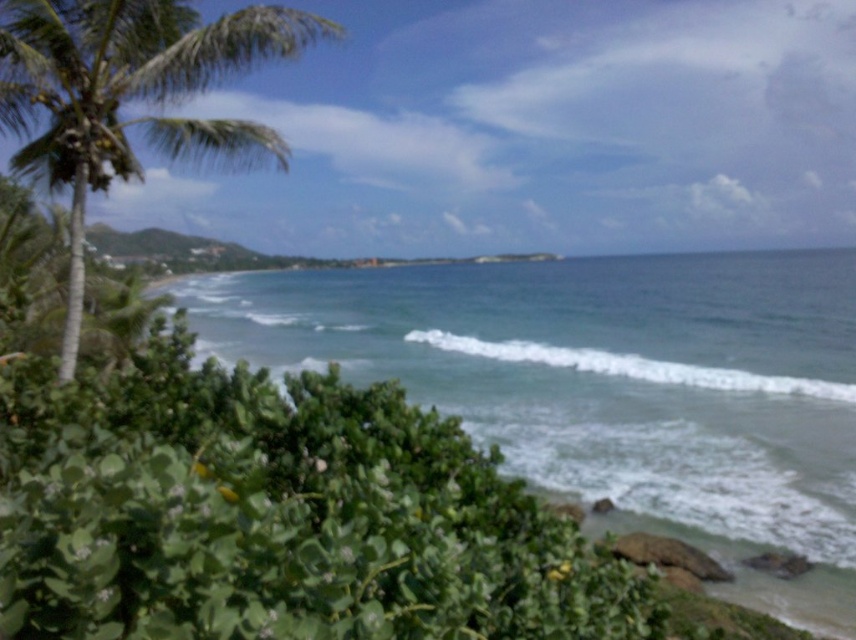
You are standing at the center of the image and want to locate the green leafy palm tree at left. In terms of 2D coordinates, where would you find it?

The green leafy palm tree at left is located at the coordinates point (129, 96).

You are standing at the point marked as point (609,387) in the image. What do you see immediately to your lower left direction?

You see green leafy water at lower left immediately to your lower left direction at point (609,387).